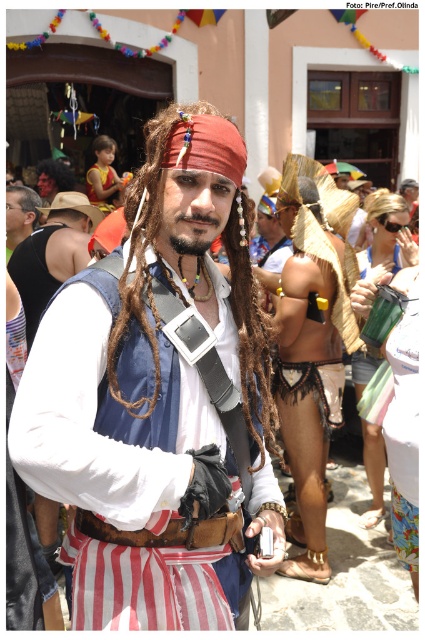
Question: Which object is positioned farthest from the brown/dreadlocks at center?

Choices:
 (A) matte blue vest at center
 (B) matte yellow vest at upper left

Answer: (B)

Question: In this image, where is matte blue vest at center located relative to dark brown hair at center?

Choices:
 (A) left
 (B) right

Answer: (A)

Question: Does brown woven fabric at center come behind white matte vest at center?

Choices:
 (A) yes
 (B) no

Answer: (B)

Question: Estimate the real-world distances between objects in this image. Which object is closer to the brown woven fabric at center?

Choices:
 (A) dark brown hair at center
 (B) matte yellow vest at upper left

Answer: (A)

Question: Which point appears closest to the camera in this image?

Choices:
 (A) coord(19,195)
 (B) coord(54,260)
 (C) coord(116,188)
 (D) coord(234,353)

Answer: (D)

Question: Does white matte vest at center appear on the left side of matte yellow vest at upper left?

Choices:
 (A) no
 (B) yes

Answer: (A)